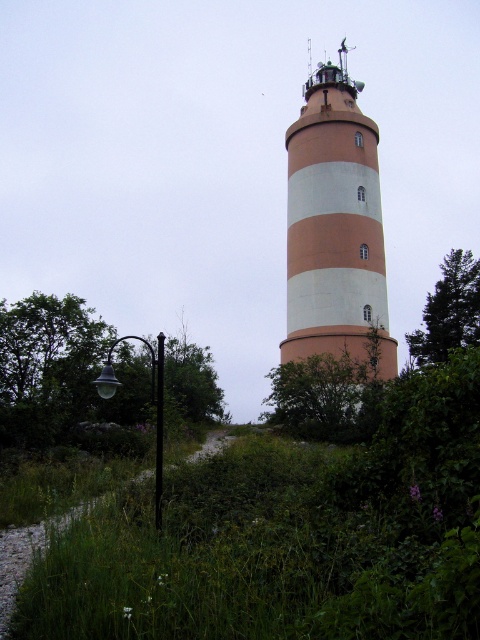
Which of these two, orange matte tower at center or gravel path at lower left, stands shorter?

With less height is gravel path at lower left.

Can you confirm if orange matte tower at center is positioned to the left of gravel path at lower left?

No, orange matte tower at center is not to the left of gravel path at lower left.

Which is in front, point (301, 310) or point (46, 536)?

Point (46, 536) is in front.

The image size is (480, 640). Identify the location of orange matte tower at center. (335, 227).

Between green leafy tree at right and gravel path at lower left, which one has more height?

With more height is green leafy tree at right.

Can you confirm if green leafy tree at right is bigger than gravel path at lower left?

Indeed, green leafy tree at right has a larger size compared to gravel path at lower left.

Which is behind, point (452, 301) or point (226, 438)?

Positioned behind is point (452, 301).

Image resolution: width=480 pixels, height=640 pixels. Find the location of `green leafy tree at right`. green leafy tree at right is located at coordinates tap(450, 310).

At what (x,y) coordinates should I click in order to perform the action: click on orange matte tower at center. Please return your answer as a coordinate pair (x, y). Looking at the image, I should click on (335, 227).

Locate an element on the screen. The height and width of the screenshot is (640, 480). orange matte tower at center is located at coordinates (335, 227).